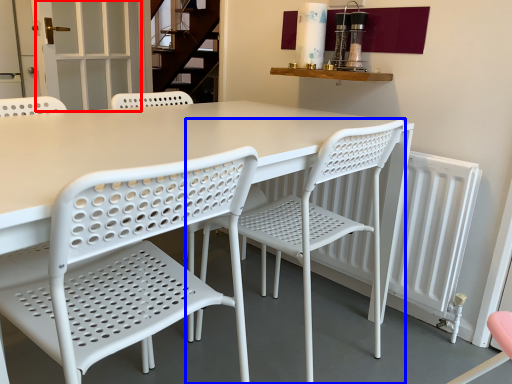
Question: Which of the following is the closest to the observer, screen door (highlighted by a red box) or chair (highlighted by a blue box)?

Choices:
 (A) screen door
 (B) chair

Answer: (B)